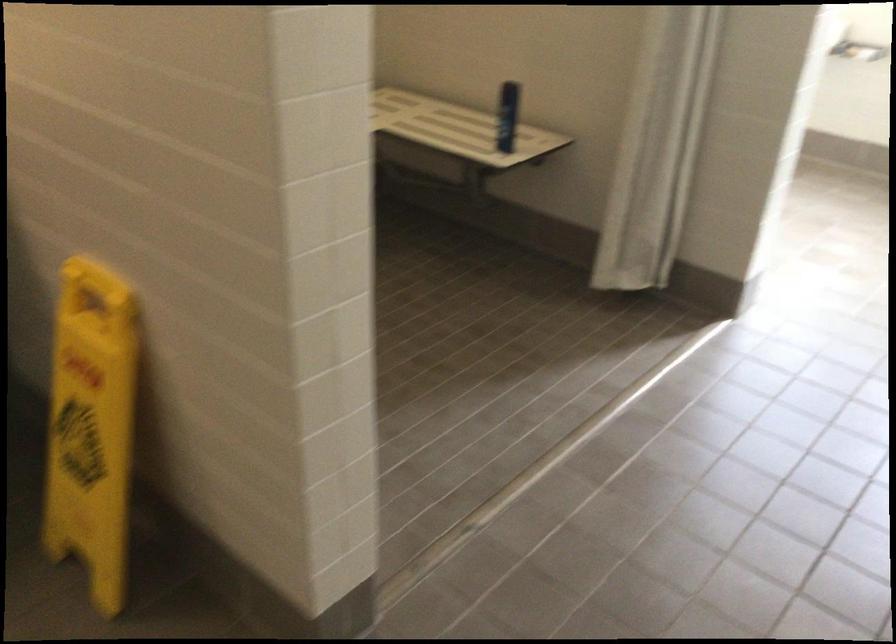
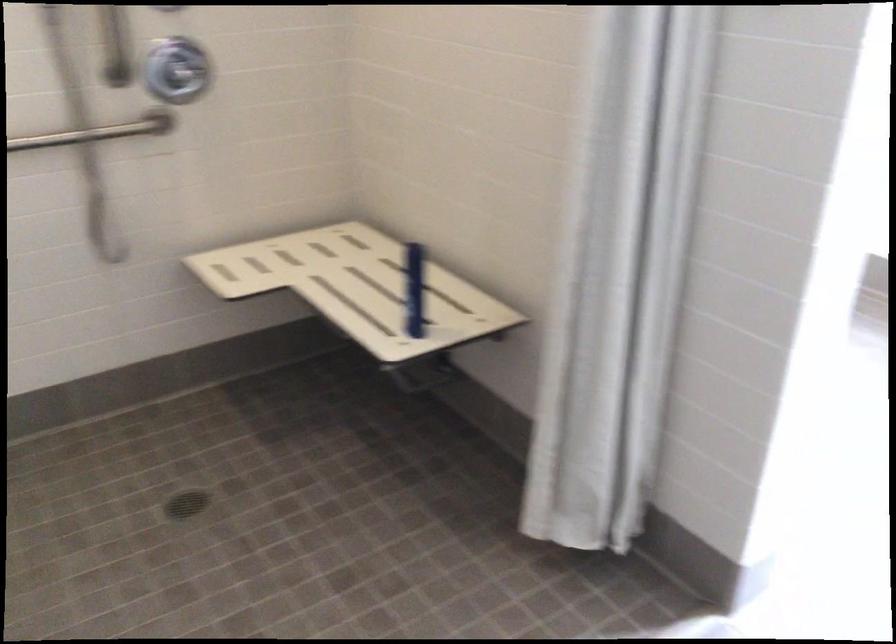
In the second image, find the point that corresponds to point (431, 131) in the first image.

(357, 287)